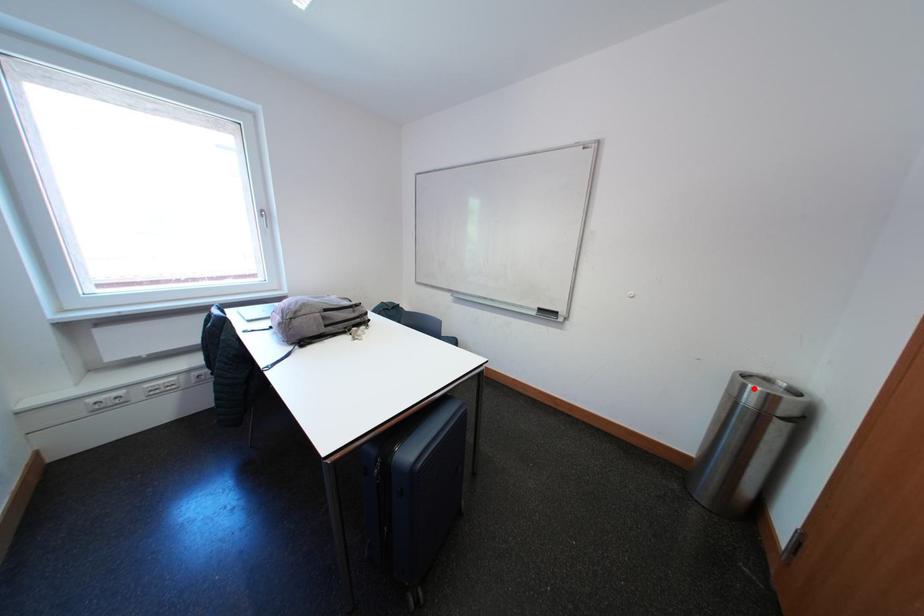
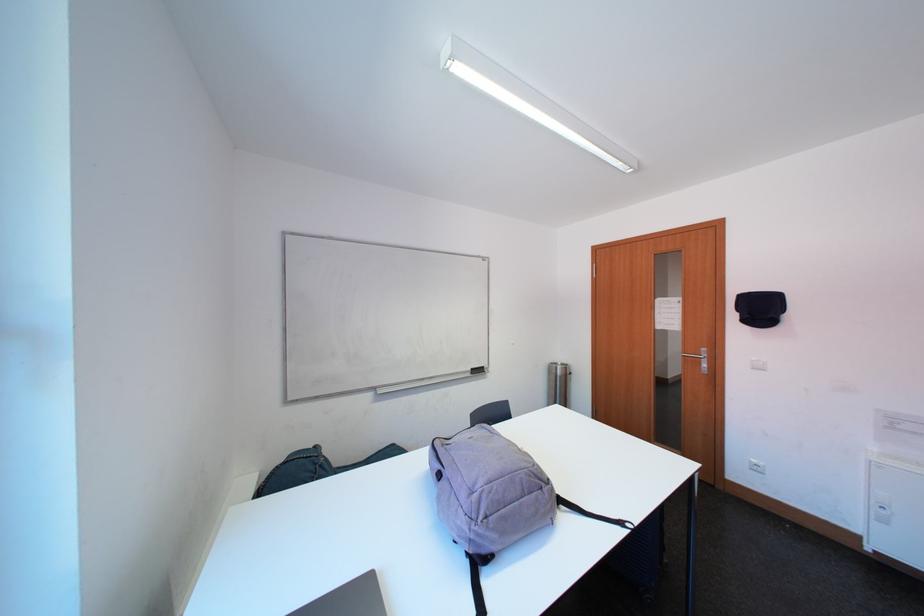
Find the pixel in the second image that matches the highlighted location in the first image.

(565, 371)